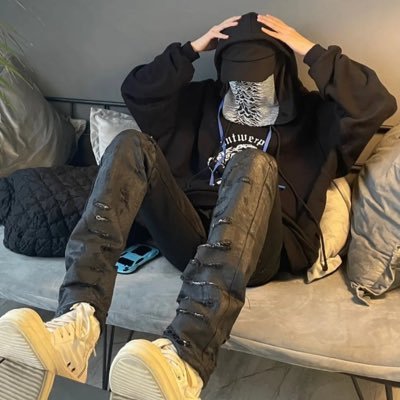
Locate an element on the screen. floor is located at coordinates (253, 370).